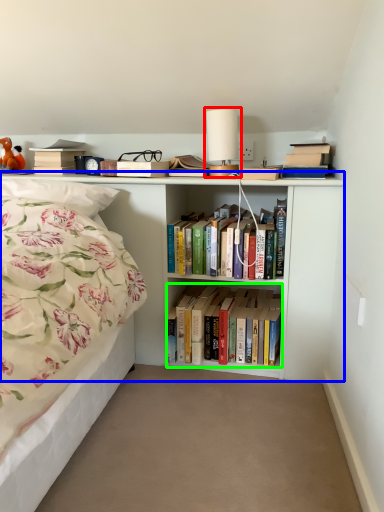
Question: Which object is positioned closest to table lamp (highlighted by a red box)? Select from bookcase (highlighted by a blue box) and book (highlighted by a green box).

Choices:
 (A) bookcase
 (B) book

Answer: (A)